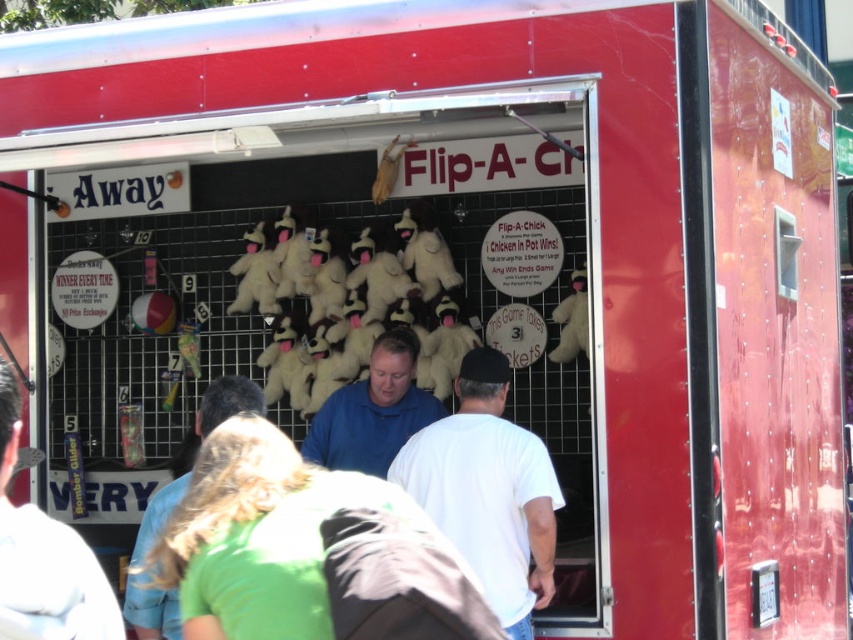
Question: Which point is closer to the camera?

Choices:
 (A) light blue shirt at center
 (B) white matte shirt at center

Answer: (B)

Question: Estimate the real-world distances between objects in this image. Which object is farther from the blue matte shirt at center?

Choices:
 (A) blue shirt at center
 (B) white matte shirt at center
 (C) light blue shirt at center

Answer: (A)

Question: Which of the following is the closest to the observer?

Choices:
 (A) white matte shirt at center
 (B) blue matte shirt at center

Answer: (A)

Question: Is blue matte shirt at center above light blue shirt at center?

Choices:
 (A) no
 (B) yes

Answer: (B)

Question: Is blue matte shirt at center further to camera compared to light blue shirt at center?

Choices:
 (A) yes
 (B) no

Answer: (A)

Question: Is blue matte shirt at center to the right of light blue shirt at center from the viewer's perspective?

Choices:
 (A) yes
 (B) no

Answer: (A)